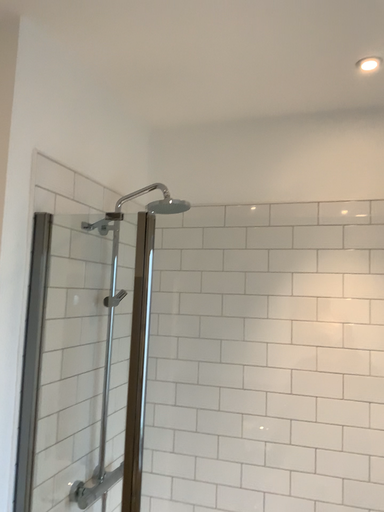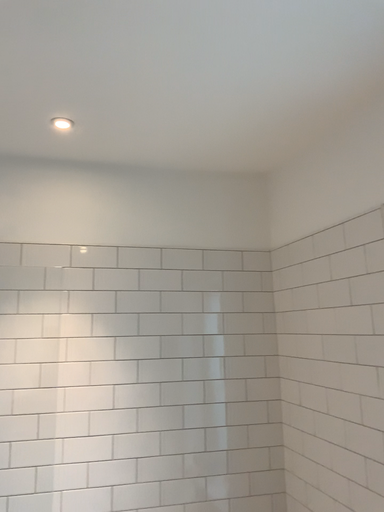
Question: Which way did the camera rotate in the video?

Choices:
 (A) rotated left
 (B) rotated right

Answer: (B)